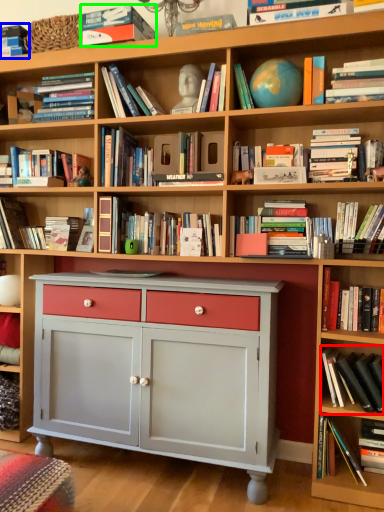
Question: Considering the real-world distances, which object is closest to book (highlighted by a red box)? book (highlighted by a blue box) or book (highlighted by a green box).

Choices:
 (A) book
 (B) book

Answer: (B)